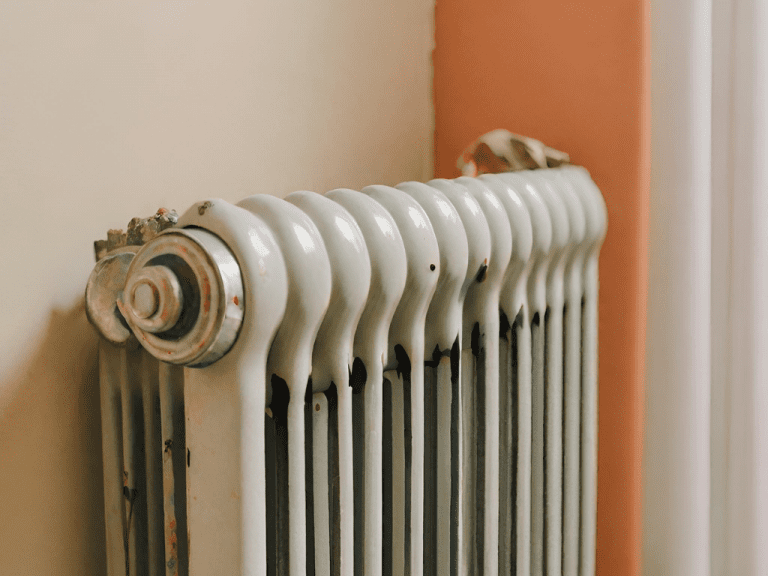
At what (x,y) coordinates should I click in order to perform the action: click on radiator. Please return your answer as a coordinate pair (x, y). Image resolution: width=768 pixels, height=576 pixels. Looking at the image, I should click on (338, 302).